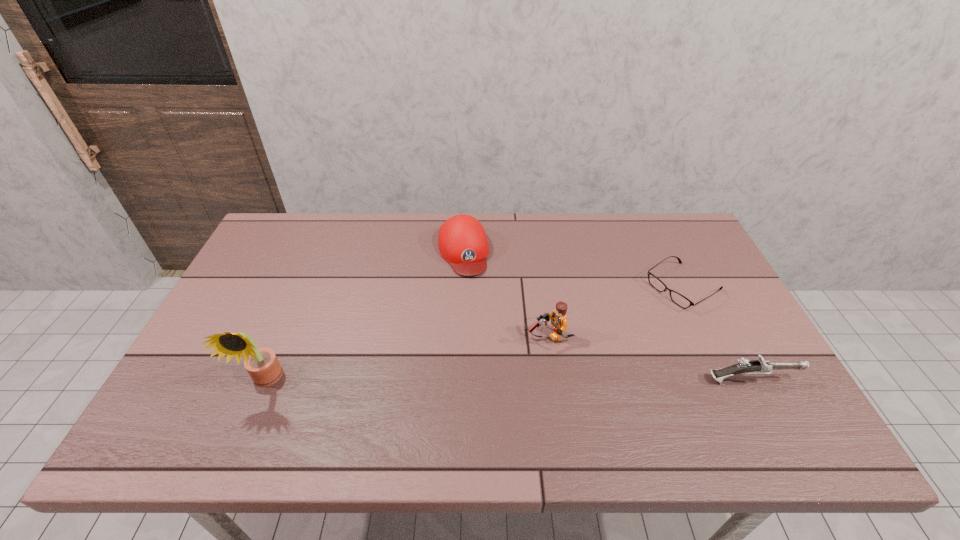
Identify the location of free spot at the near right corner of the desktop. Image resolution: width=960 pixels, height=540 pixels. (762, 409).

At what (x,y) coordinates should I click in order to perform the action: click on free space that is in between the gun and the Lego. Please return your answer as a coordinate pair (x, y). This screenshot has height=540, width=960. Looking at the image, I should click on (649, 358).

Where is `free space that is in between the shortest object and the gun`? The height and width of the screenshot is (540, 960). free space that is in between the shortest object and the gun is located at coordinates (717, 334).

At what (x,y) coordinates should I click in order to perform the action: click on vacant space in between the fourth tallest object and the sunflower. Please return your answer as a coordinate pair (x, y). Looking at the image, I should click on (509, 380).

What are the coordinates of `free space between the third nearest object and the leftmost object` in the screenshot? It's located at (407, 359).

Identify the location of empty location between the baseball cap and the shortest object. The image size is (960, 540). (573, 269).

Find the location of a particular element. This screenshot has height=540, width=960. free point between the second object from left to right and the sunflower is located at coordinates (365, 316).

Where is `free space between the leftmost object and the third object from left to right`? The height and width of the screenshot is (540, 960). free space between the leftmost object and the third object from left to right is located at coordinates (407, 359).

At what (x,y) coordinates should I click in order to perform the action: click on free space between the spectacles and the gun. Please return your answer as a coordinate pair (x, y). Image resolution: width=960 pixels, height=540 pixels. Looking at the image, I should click on (717, 334).

This screenshot has height=540, width=960. In order to click on empty space that is in between the leftmost object and the second shortest object in this screenshot , I will do `click(509, 380)`.